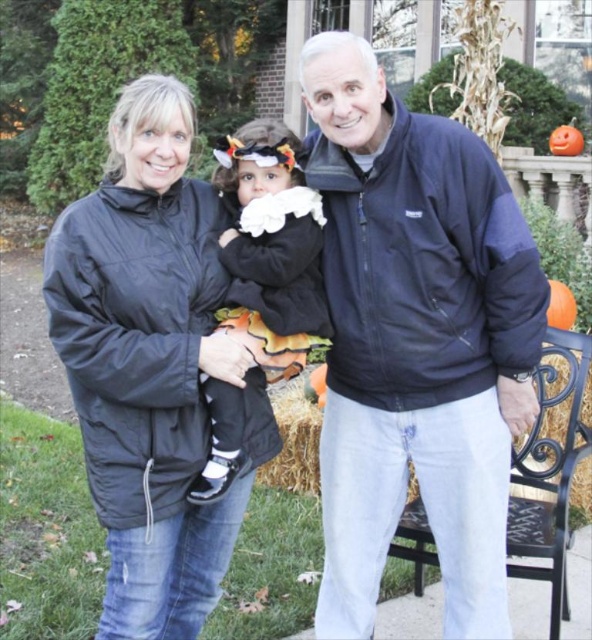
Question: Which is farther from the navy blue jacket at center?

Choices:
 (A) velvet black dress at center
 (B) orange matte pumpkin at center

Answer: (B)

Question: Does black matte jacket at center have a larger size compared to velvet black dress at center?

Choices:
 (A) yes
 (B) no

Answer: (A)

Question: Does navy blue jacket at center have a smaller size compared to orange matte pumpkin at right?

Choices:
 (A) no
 (B) yes

Answer: (A)

Question: Which point is closer to the camera?

Choices:
 (A) velvet black dress at center
 (B) orange matte pumpkin at upper right
 (C) orange matte pumpkin at center
 (D) orange matte pumpkin at right

Answer: (A)

Question: Estimate the real-world distances between objects in this image. Which object is farther from the orange matte pumpkin at center?

Choices:
 (A) orange matte pumpkin at upper right
 (B) velvet black dress at center

Answer: (A)

Question: Is black matte jacket at center behind orange matte pumpkin at right?

Choices:
 (A) yes
 (B) no

Answer: (B)